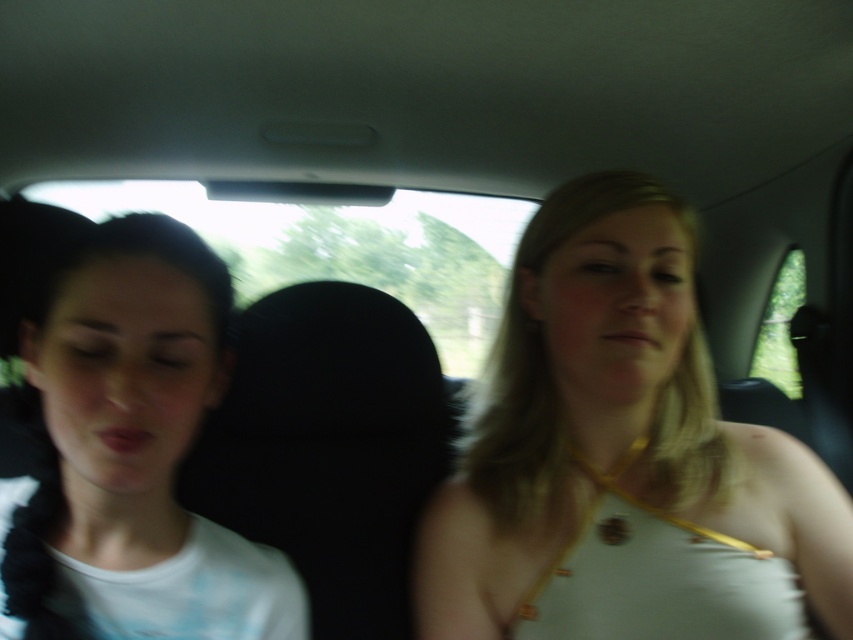
Question: Which object is positioned closest to the black fabric headrest at center?

Choices:
 (A) white matte shirt at left
 (B) white fabric top at center

Answer: (B)

Question: Is white matte shirt at left closer to camera compared to black fabric headrest at center?

Choices:
 (A) yes
 (B) no

Answer: (A)

Question: Does white matte shirt at left have a smaller size compared to black fabric headrest at center?

Choices:
 (A) no
 (B) yes

Answer: (B)

Question: Considering the real-world distances, which object is closest to the white matte shirt at left?

Choices:
 (A) white fabric top at center
 (B) black fabric headrest at center

Answer: (A)

Question: Which point is farther from the camera taking this photo?

Choices:
 (A) [x=607, y=568]
 (B) [x=161, y=572]
 (C) [x=403, y=330]

Answer: (C)

Question: Where is white fabric top at center located in relation to white matte shirt at left in the image?

Choices:
 (A) left
 (B) right

Answer: (B)